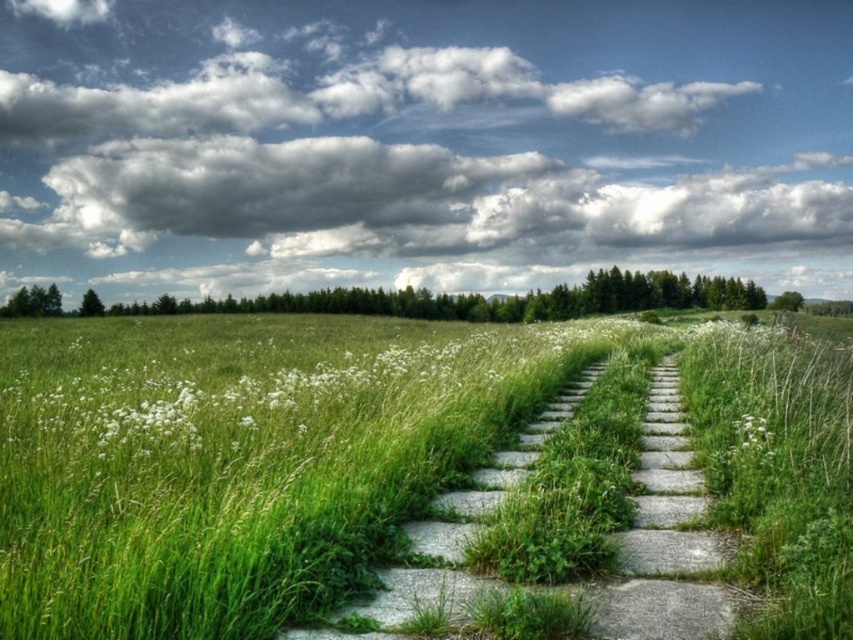
Question: Which object appears farthest from the camera in this image?

Choices:
 (A) green stone path at center
 (B) white fluffy flower at center-right

Answer: (B)

Question: Which object is positioned closest to the green grassy pasture at center?

Choices:
 (A) white fluffy flower at center-right
 (B) gray concrete path at center
 (C) green stone path at center

Answer: (A)

Question: Is green grassy pasture at center below gray concrete path at center?

Choices:
 (A) yes
 (B) no

Answer: (B)

Question: In this image, where is green grassy pasture at center located relative to gray concrete path at center?

Choices:
 (A) left
 (B) right

Answer: (A)

Question: Which object appears closest to the camera in this image?

Choices:
 (A) cloudy sky at upper center
 (B) green grassy pasture at center
 (C) gray concrete path at center
 (D) green stone path at center

Answer: (B)

Question: Is green grassy pasture at center in front of white fluffy flower at center-right?

Choices:
 (A) yes
 (B) no

Answer: (A)